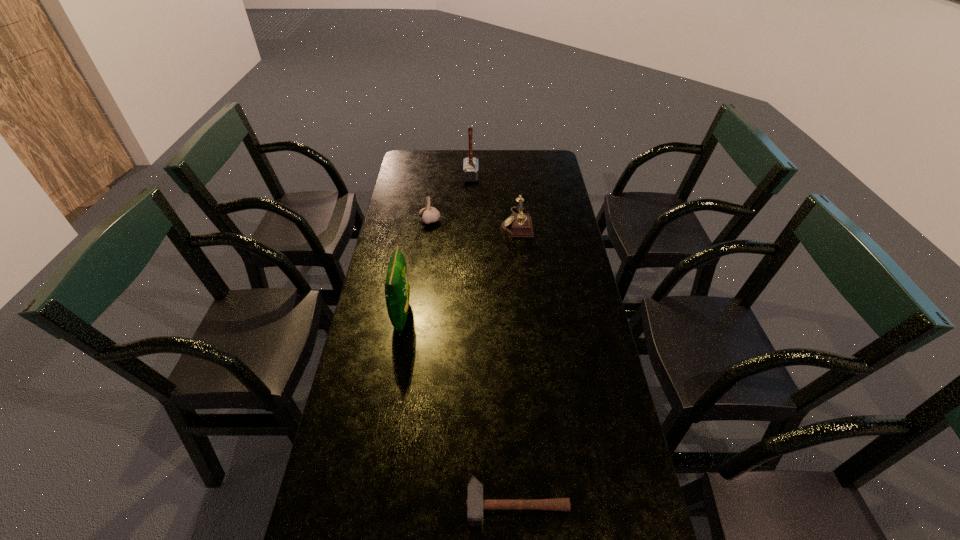
Where is `vacant space located on the dial of the telephone`? This screenshot has height=540, width=960. vacant space located on the dial of the telephone is located at coordinates (444, 223).

Locate an element on the screen. The image size is (960, 540). vacant space located on the dial of the telephone is located at coordinates (457, 223).

Locate an element on the screen. free space located 0.140m on the right of the garlic is located at coordinates (475, 221).

The image size is (960, 540). In order to click on object located in the far edge section of the desktop in this screenshot , I will do `click(470, 165)`.

Where is `crisp (potato chip) that is positioned at the left edge`? crisp (potato chip) that is positioned at the left edge is located at coordinates (397, 290).

I want to click on garlic located in the left edge section of the desktop, so click(428, 214).

You are a GUI agent. You are given a task and a screenshot of the screen. Output one action in this format:
    pyautogui.click(x=<x>, y=<y>)
    Task: Click on the object positioned at the right edge
    
    Given the screenshot: What is the action you would take?
    pyautogui.click(x=519, y=224)

You are a GUI agent. You are given a task and a screenshot of the screen. Output one action in this format:
    pyautogui.click(x=<x>, y=<y>)
    Task: Click on the vacant space at the far edge
    The height and width of the screenshot is (540, 960).
    Given the screenshot: What is the action you would take?
    pyautogui.click(x=497, y=161)

Locate an element on the screen. The height and width of the screenshot is (540, 960). blank space at the left edge is located at coordinates (357, 366).

You are a GUI agent. You are given a task and a screenshot of the screen. Output one action in this format:
    pyautogui.click(x=<x>, y=<y>)
    Task: Click on the vacant space at the right edge of the desktop
    
    Given the screenshot: What is the action you would take?
    pyautogui.click(x=612, y=457)